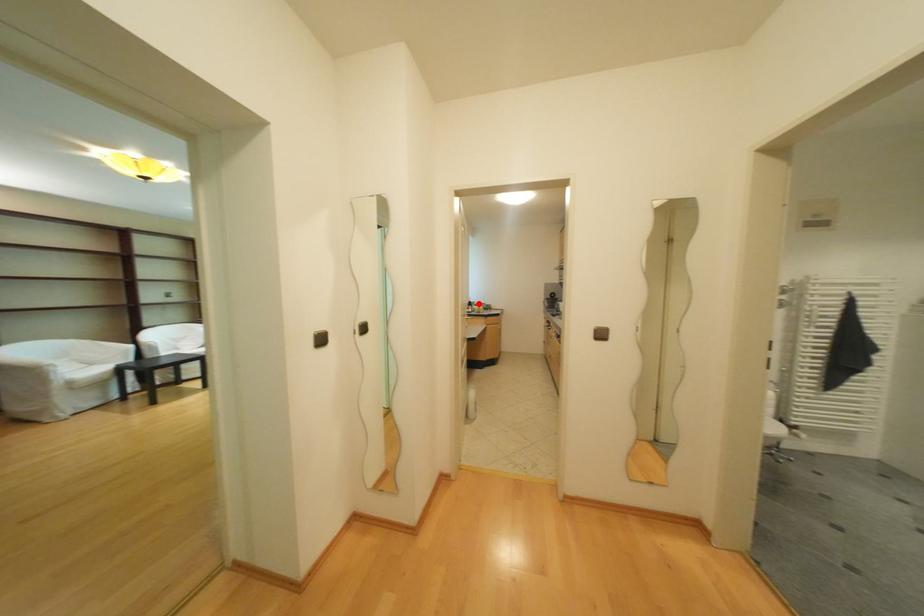
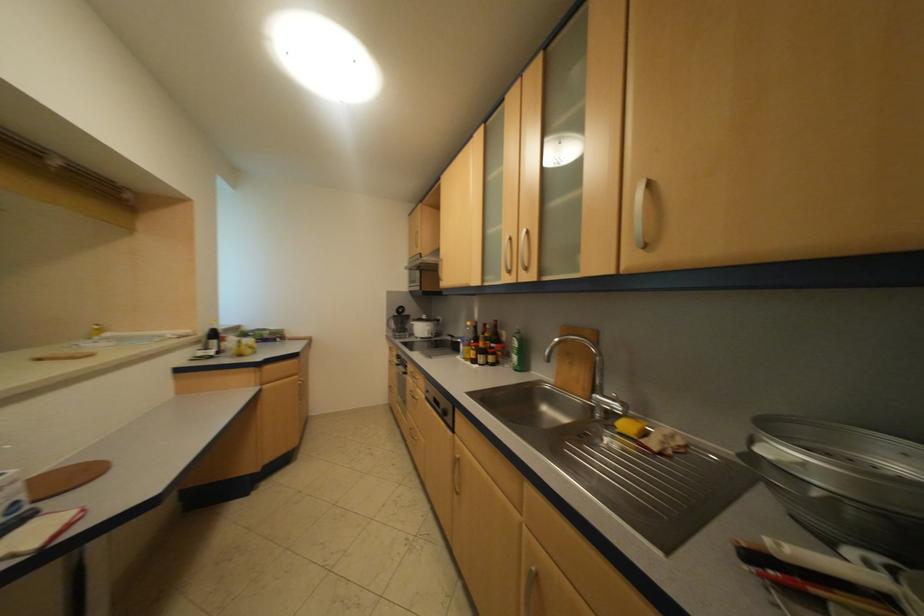
Locate, in the second image, the point that corresponds to the highlighted location in the first image.

(214, 334)